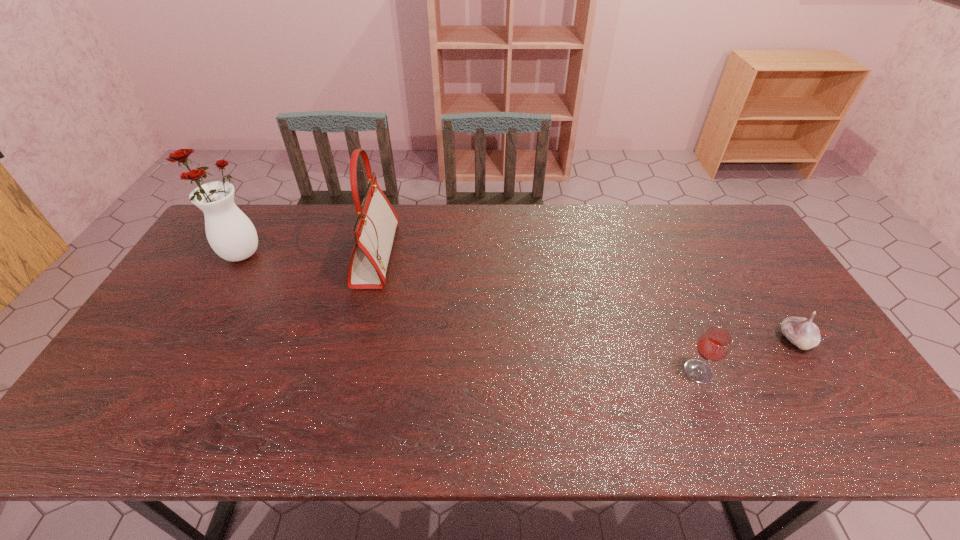
In order to click on handbag that is at the far edge in this screenshot , I will do `click(374, 231)`.

Find the location of a particular element. This screenshot has width=960, height=540. vase that is at the far edge is located at coordinates (230, 233).

Locate an element on the screen. object at the left edge is located at coordinates (x=230, y=233).

Find the location of `object that is at the right edge`. object that is at the right edge is located at coordinates (802, 332).

Image resolution: width=960 pixels, height=540 pixels. Identify the location of object that is positioned at the far left corner. (230, 233).

Image resolution: width=960 pixels, height=540 pixels. In the image, there is a desktop. Find the location of `vacant region at the far edge`. vacant region at the far edge is located at coordinates (624, 207).

This screenshot has width=960, height=540. In order to click on vacant space at the near edge of the desktop in this screenshot , I will do 383,439.

Identify the location of vacant space at the left edge. (209, 267).

Locate an element on the screen. Image resolution: width=960 pixels, height=540 pixels. vacant space at the right edge of the desktop is located at coordinates (782, 363).

Locate an element on the screen. This screenshot has height=540, width=960. vacant position at the near right corner of the desktop is located at coordinates (813, 416).